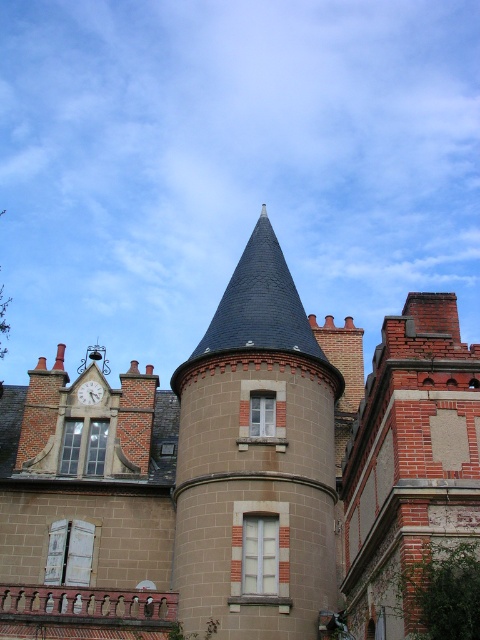
Question: Which point is farther to the camera?

Choices:
 (A) white marble clock at upper left
 (B) smooth gray stone tower at center

Answer: (A)

Question: Is brown stone turret at center closer to camera compared to smooth gray stone tower at center?

Choices:
 (A) yes
 (B) no

Answer: (A)

Question: Where is brown stone turret at center located in relation to smooth gray stone tower at center in the image?

Choices:
 (A) above
 (B) below

Answer: (B)

Question: Is brown stone turret at center to the left of white marble clock at upper left from the viewer's perspective?

Choices:
 (A) no
 (B) yes

Answer: (A)

Question: Which of the following is the closest to the observer?

Choices:
 (A) (152, 428)
 (B) (225, 621)

Answer: (B)

Question: Based on their relative distances, which object is nearer to the brown stone turret at center?

Choices:
 (A) white marble clock at upper left
 (B) smooth gray stone tower at center

Answer: (B)